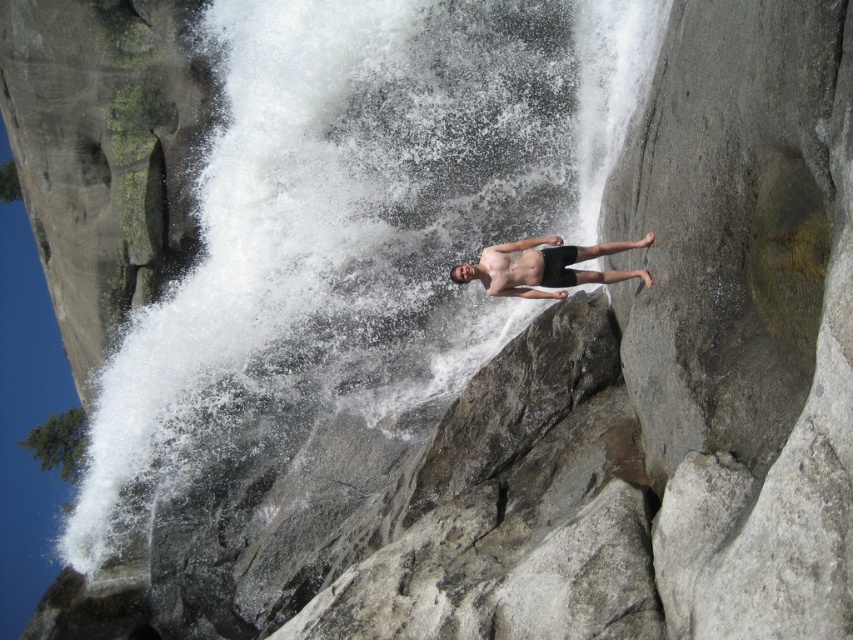
You are a photographer trying to capture the scene with the white frothy water at center and the smooth black shorts at center. Which object is located to the left of the other?

The white frothy water at center is positioned on the left side of smooth black shorts at center.